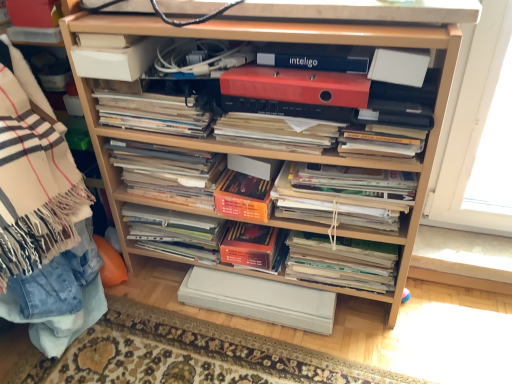
Find the location of `empty space that is ontop of matte red folder at center, the 5th paperback book when ordered from bottom to top (from a real-world perspective)`. empty space that is ontop of matte red folder at center, the 5th paperback book when ordered from bottom to top (from a real-world perspective) is located at coordinates (297, 66).